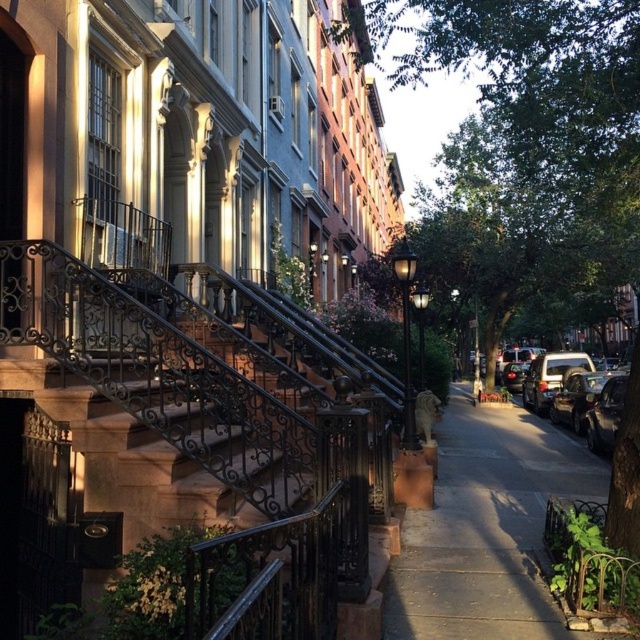
You are a delivery person trying to park your metallic silver suv at right near the black wrought iron balustrade at center. Can you park the suv closer to the balustrade without moving any other vehicles?

The black wrought iron balustrade at center is closer to the viewer than the metallic silver suv at right, so you can park the metallic silver suv at right closer to the balustrade as it is already positioned further away from the viewer.

You are standing on the street looking at the black wrought iron balustrade at center. What are the coordinates of the balustrade in the image?

The coordinates of the black wrought iron balustrade at center are at point (216, 440).

You are a delivery driver approaching the black wrought iron balustrade at center and the metallic silver suv at right. Which object is positioned closer to the left side of the scene?

The black wrought iron balustrade at center is positioned to the left of the metallic silver suv at right, so it is closer to the left side of the scene.